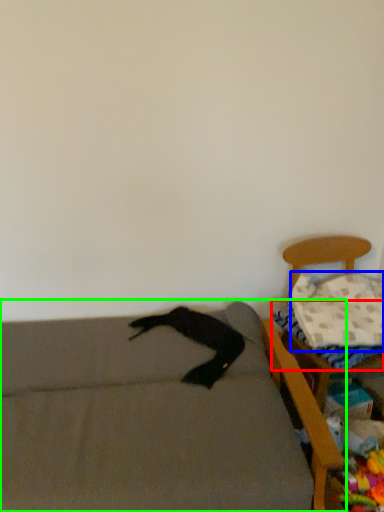
Question: Which object is positioned closest to sheet (highlighted by a red box)? Select from pillow (highlighted by a blue box) and furniture (highlighted by a green box).

Choices:
 (A) pillow
 (B) furniture

Answer: (A)